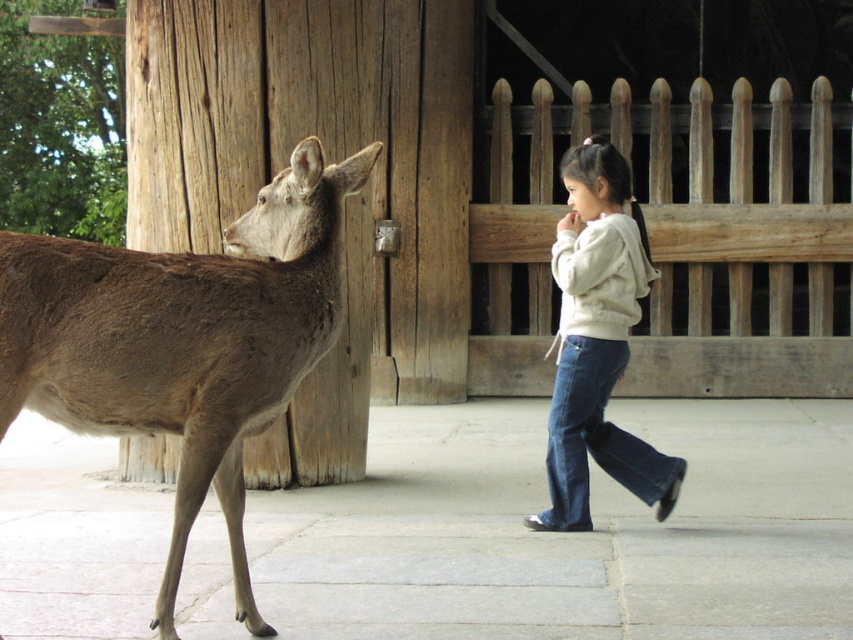
Question: Which object appears closest to the camera in this image?

Choices:
 (A) light beige hoodie at center
 (B) brown fur deer at left

Answer: (B)

Question: Can you confirm if brown fur deer at left is smaller than light beige hoodie at center?

Choices:
 (A) yes
 (B) no

Answer: (B)

Question: Can you confirm if brown fur deer at left is positioned to the right of denim jeans at lower right?

Choices:
 (A) no
 (B) yes

Answer: (A)

Question: Is light beige hoodie at center positioned at the back of denim jeans at lower right?

Choices:
 (A) yes
 (B) no

Answer: (B)

Question: Which object is closer to the camera taking this photo?

Choices:
 (A) light beige hoodie at center
 (B) brown fur deer at left

Answer: (B)

Question: Which object appears closest to the camera in this image?

Choices:
 (A) denim jeans at lower right
 (B) light beige hoodie at center
 (C) brown fur deer at left

Answer: (C)